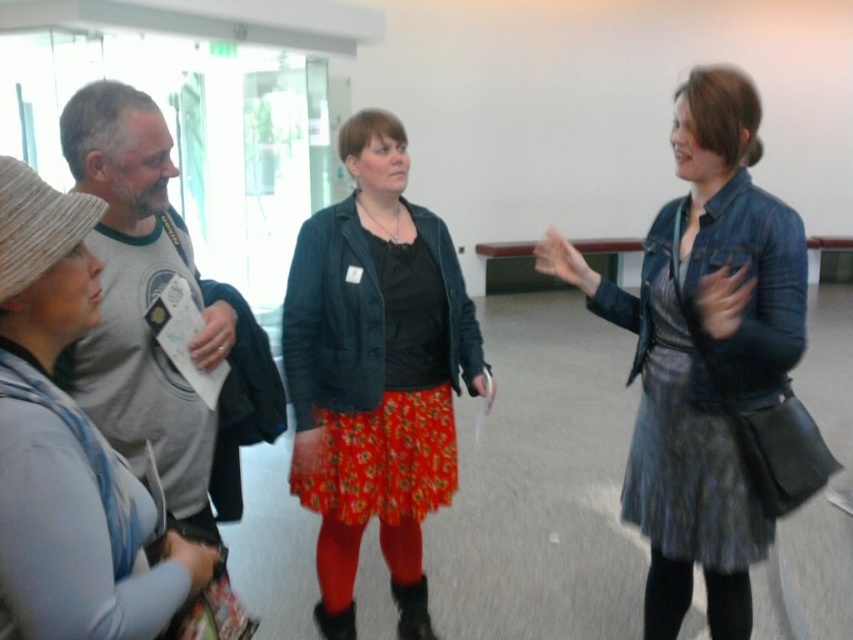
Can you confirm if floral skirt at center is taller than black tights at lower right?

Yes.

Does point (354, 216) lie in front of point (730, 579)?

That is False.

What are the coordinates of `floral skirt at center` in the screenshot? It's located at (375, 372).

Does gray cotton t-shirt at left have a lesser width compared to black tights at lower right?

In fact, gray cotton t-shirt at left might be wider than black tights at lower right.

Is gray cotton t-shirt at left above black tights at lower right?

Indeed, gray cotton t-shirt at left is positioned over black tights at lower right.

Describe the element at coordinates (144, 305) in the screenshot. The height and width of the screenshot is (640, 853). I see `gray cotton t-shirt at left` at that location.

I want to click on gray cotton t-shirt at left, so click(x=144, y=305).

Is point (422, 371) closer to viewer compared to point (177, 253)?

No.

Is point (318, 358) positioned after point (144, 113)?

Yes, it is behind point (144, 113).

Locate an element on the screen. The height and width of the screenshot is (640, 853). floral skirt at center is located at coordinates (375, 372).